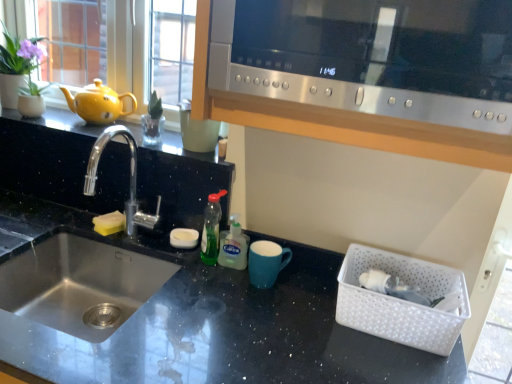
In order to click on free space above black granite countertop at center (from a real-world perspective) in this screenshot , I will do `click(190, 289)`.